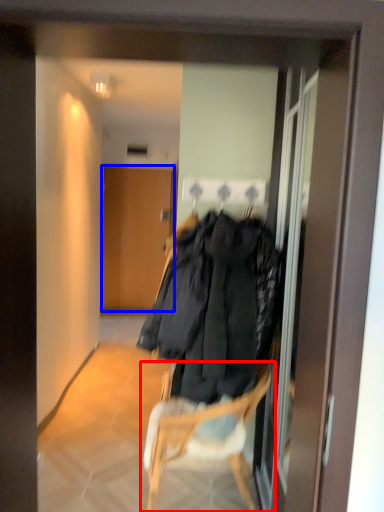
Question: Which object appears closest to the camera in this image, chair (highlighted by a red box) or door (highlighted by a blue box)?

Choices:
 (A) chair
 (B) door

Answer: (A)